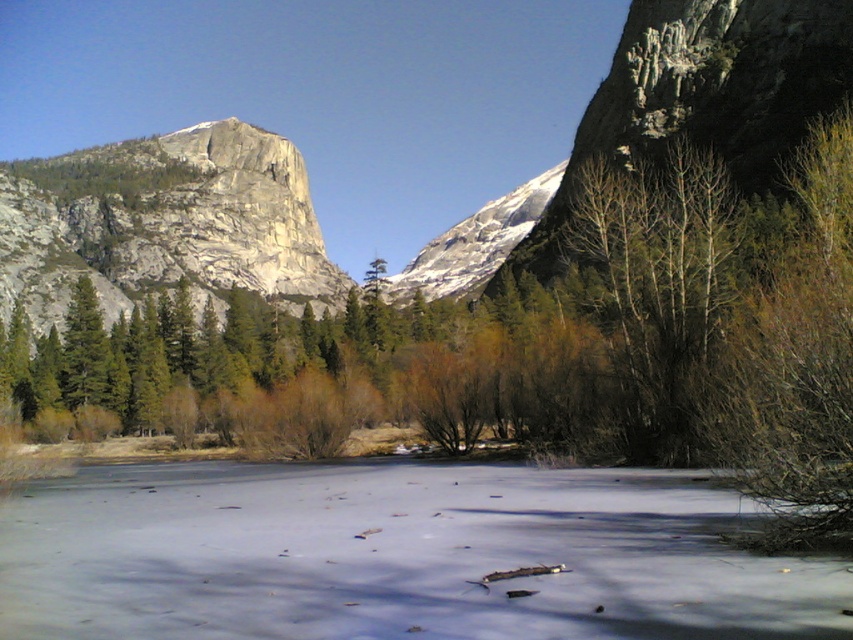
You are standing at the edge of the frozen body of water and want to cross to the other side. There is a granite cliff at left and frozen ice at center. Which path should you choose to reach the other side safely?

You should choose the frozen ice at center because it is closer to the viewer than the granite cliff at left, making it the safer and more accessible path for crossing.

You are planning to cross the frozen ice at center to reach the other side. Considering the width of the ice compared to the granite cliff at left, do you think the ice is wide enough for safe passage?

The frozen ice at center is narrower than the granite cliff at left, so it may not be wide enough for safe passage. Proceed with caution or choose a different route.